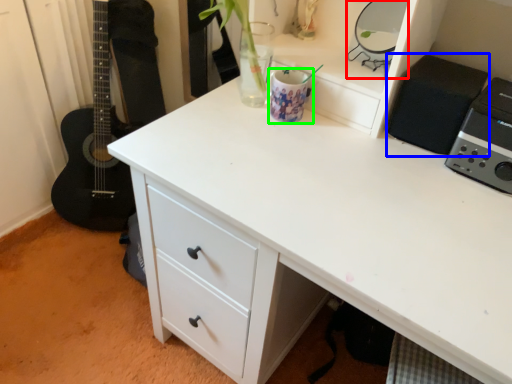
Question: Which object is the closest to the appliance (highlighted by a red box)? Choose among these: appliance (highlighted by a blue box) or appliance (highlighted by a green box).

Choices:
 (A) appliance
 (B) appliance

Answer: (A)